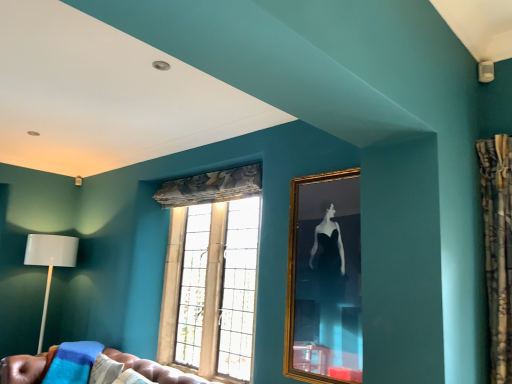
Question: Does gold-framed mirror at center-right come behind white matte floor lamp at left?

Choices:
 (A) no
 (B) yes

Answer: (A)

Question: Does gold-framed mirror at center-right have a lesser width compared to white matte floor lamp at left?

Choices:
 (A) yes
 (B) no

Answer: (A)

Question: Does gold-framed mirror at center-right appear on the left side of white matte floor lamp at left?

Choices:
 (A) yes
 (B) no

Answer: (B)

Question: Can you confirm if gold-framed mirror at center-right is taller than white matte floor lamp at left?

Choices:
 (A) no
 (B) yes

Answer: (A)

Question: Can you confirm if gold-framed mirror at center-right is bigger than white matte floor lamp at left?

Choices:
 (A) no
 (B) yes

Answer: (A)

Question: In the image, is white matte floor lamp at left positioned in front of or behind gold-framed mirror at center-right?

Choices:
 (A) front
 (B) behind

Answer: (B)

Question: Is white matte floor lamp at left inside or outside of gold-framed mirror at center-right?

Choices:
 (A) outside
 (B) inside

Answer: (A)

Question: Is white matte floor lamp at left wider or thinner than gold-framed mirror at center-right?

Choices:
 (A) thin
 (B) wide

Answer: (B)

Question: From their relative heights in the image, would you say white matte floor lamp at left is taller or shorter than gold-framed mirror at center-right?

Choices:
 (A) short
 (B) tall

Answer: (B)

Question: From the image's perspective, is leather tufted couch at lower left positioned above or below stained glass window at center?

Choices:
 (A) above
 (B) below

Answer: (B)

Question: Choose the correct answer: Is leather tufted couch at lower left inside stained glass window at center or outside it?

Choices:
 (A) outside
 (B) inside

Answer: (A)

Question: Is leather tufted couch at lower left taller or shorter than stained glass window at center?

Choices:
 (A) short
 (B) tall

Answer: (A)

Question: Is leather tufted couch at lower left in front of or behind stained glass window at center in the image?

Choices:
 (A) front
 (B) behind

Answer: (A)

Question: Is stained glass window at center in front of or behind gold-framed mirror at center-right in the image?

Choices:
 (A) front
 (B) behind

Answer: (B)

Question: Is stained glass window at center inside or outside of gold-framed mirror at center-right?

Choices:
 (A) outside
 (B) inside

Answer: (A)